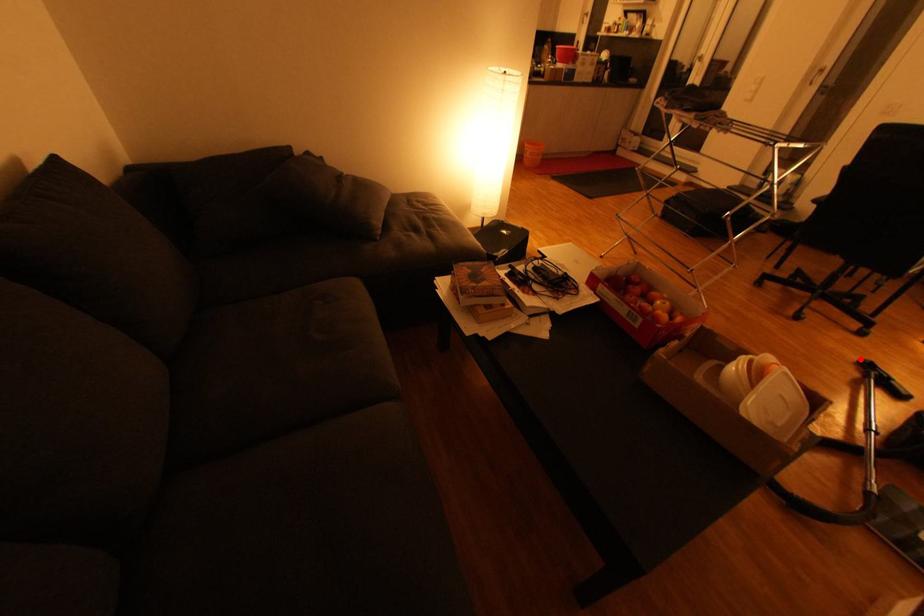
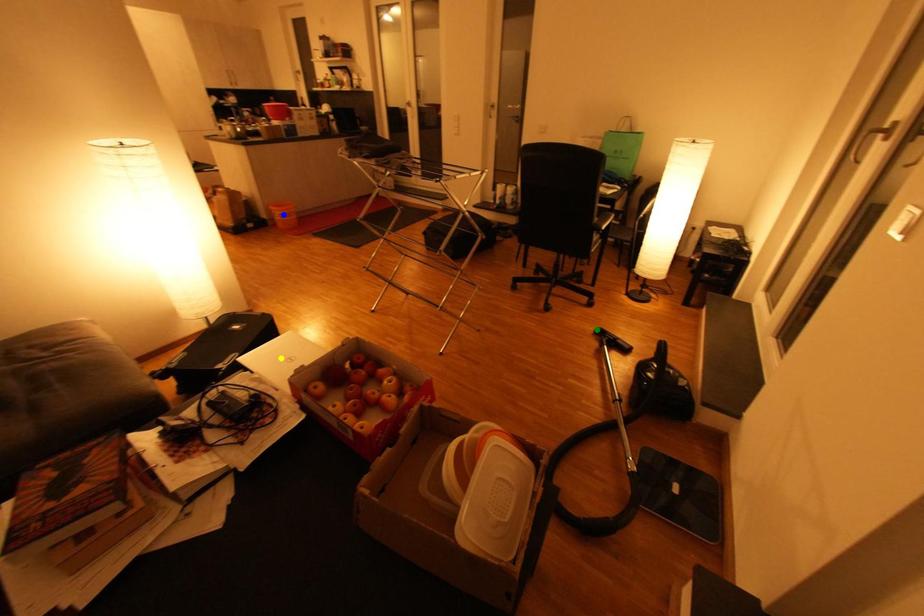
Question: I am providing you with two images of the same scene from different viewpoints. A red point is marked on the first image. You are given multiple points on the second image. Which point in image 2 represents the same 3d spot as the red point in image 1?

Choices:
 (A) yellow point
 (B) green point
 (C) blue point

Answer: (B)